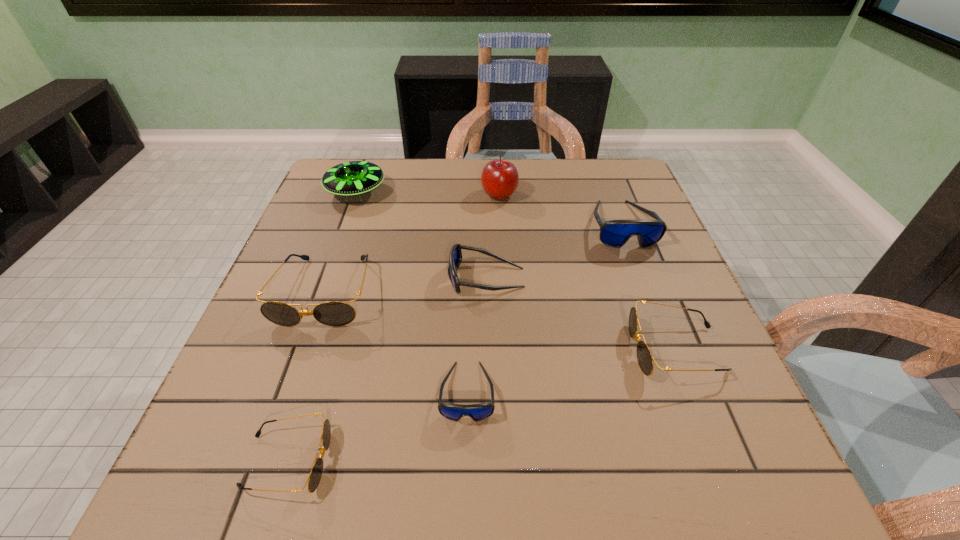
Locate which sunglasses is the second closest to the farthest blue sunglasses. Please provide its 2D coordinates. Your answer should be formatted as a tuple, i.e. [(x, y)], where the tuple contains the x and y coordinates of a point satisfying the conditions above.

[(644, 356)]

Identify which blue sunglasses is the nearest to the second farthest blue sunglasses. Please provide its 2D coordinates. Your answer should be formatted as a tuple, i.e. [(x, y)], where the tuple contains the x and y coordinates of a point satisfying the conditions above.

[(477, 412)]

You are a GUI agent. You are given a task and a screenshot of the screen. Output one action in this format:
    pyautogui.click(x=<x>, y=<y>)
    Task: Click on the blue sunglasses that is the closest one to the shortest object
    Image resolution: width=960 pixels, height=540 pixels.
    Given the screenshot: What is the action you would take?
    point(477,412)

The width and height of the screenshot is (960, 540). In order to click on black sunglasses that stands as the second closest to the second farthest blue sunglasses in this screenshot , I will do `click(644, 356)`.

Select which black sunglasses appears as the second closest to the apple. Please provide its 2D coordinates. Your answer should be formatted as a tuple, i.e. [(x, y)], where the tuple contains the x and y coordinates of a point satisfying the conditions above.

[(644, 356)]

Find the location of a particular element. The height and width of the screenshot is (540, 960). vacant space that satisfies the following two spatial constraints: 1. on the front-facing side of the second biggest blue sunglasses; 2. on the front-facing side of the smallest blue sunglasses is located at coordinates (488, 392).